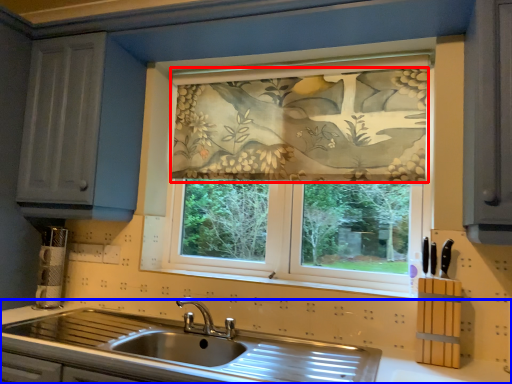
Question: Which point is closer to the camera, curtain (highlighted by a red box) or countertop (highlighted by a blue box)?

Choices:
 (A) curtain
 (B) countertop

Answer: (B)